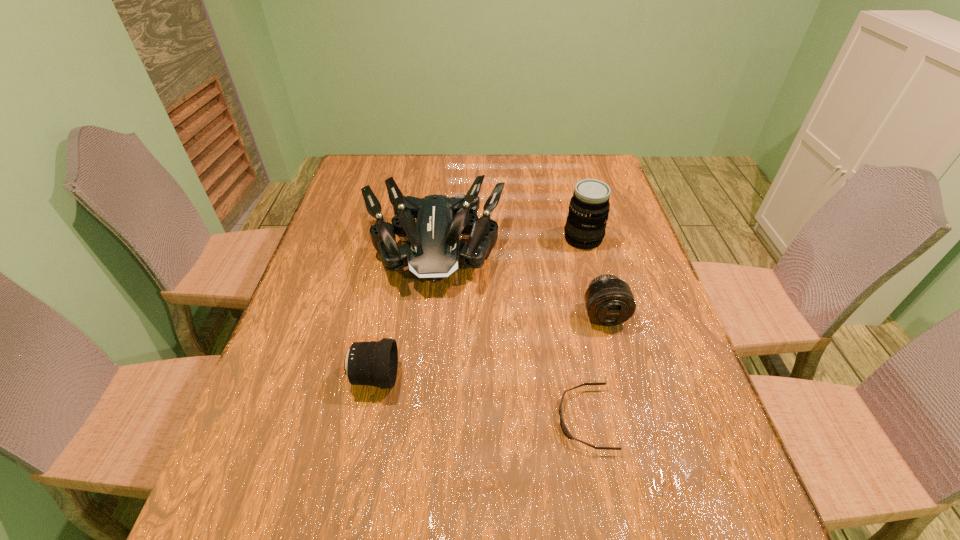
You are a GUI agent. You are given a task and a screenshot of the screen. Output one action in this format:
    pyautogui.click(x=<x>, y=<y>)
    Task: Click on the free region located on the front-facing side of the shortest object
    Image resolution: width=960 pixels, height=540 pixels.
    Given the screenshot: What is the action you would take?
    pyautogui.click(x=514, y=420)

Identify the location of vacant space located 0.380m on the front-facing side of the shortest object. Image resolution: width=960 pixels, height=540 pixels. (369, 420).

Where is `free space located on the front-facing side of the shortest object`? free space located on the front-facing side of the shortest object is located at coordinates (498, 420).

The width and height of the screenshot is (960, 540). Identify the location of object that is at the left edge. (434, 251).

Find the location of a particular element. The width and height of the screenshot is (960, 540). vacant space at the far edge of the desktop is located at coordinates (470, 160).

Locate an element on the screen. The image size is (960, 540). vacant position at the left edge of the desktop is located at coordinates (323, 242).

Where is `free space at the right edge of the desktop`? This screenshot has width=960, height=540. free space at the right edge of the desktop is located at coordinates (597, 254).

Image resolution: width=960 pixels, height=540 pixels. I want to click on vacant space at the far left corner of the desktop, so click(x=351, y=186).

Locate an element on the screen. free area in between the farthest telephoto lens and the sunglasses is located at coordinates (584, 329).

Identify the location of free space between the second farthest telephoto lens and the leftmost telephoto lens. This screenshot has height=540, width=960. (490, 346).